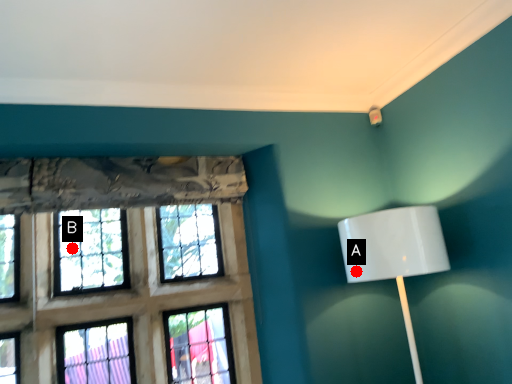
Question: Two points are circled on the image, labeled by A and B beside each circle. Which of the following is the farthest from the observer?

Choices:
 (A) A is further
 (B) B is further

Answer: (B)